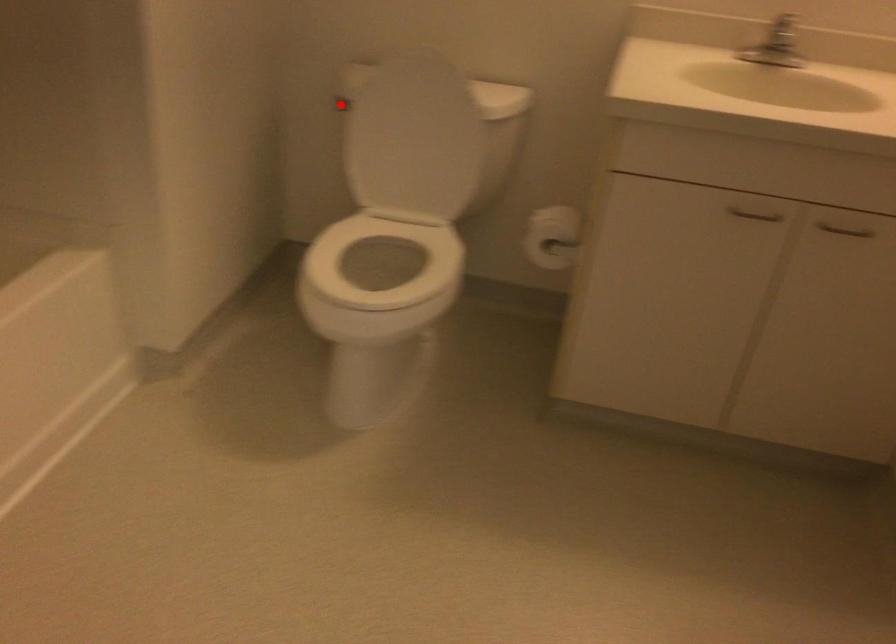
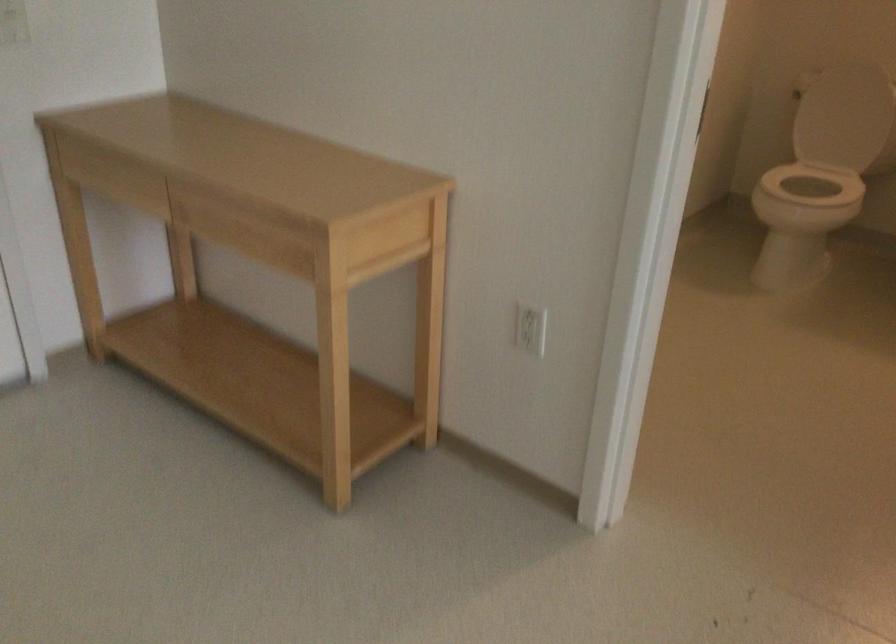
Question: I am providing you with two images of the same scene from different viewpoints. A red point is marked on the first image. At the location where the point appears in image 1, is it still visible in image 2?

Choices:
 (A) Yes
 (B) No

Answer: (B)